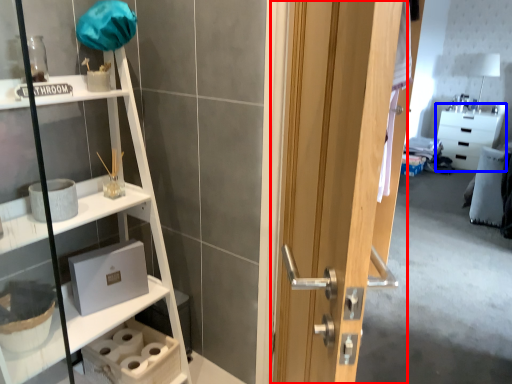
Question: Which of the following is the farthest to the observer, door (highlighted by a red box) or cabinetry (highlighted by a blue box)?

Choices:
 (A) door
 (B) cabinetry

Answer: (B)